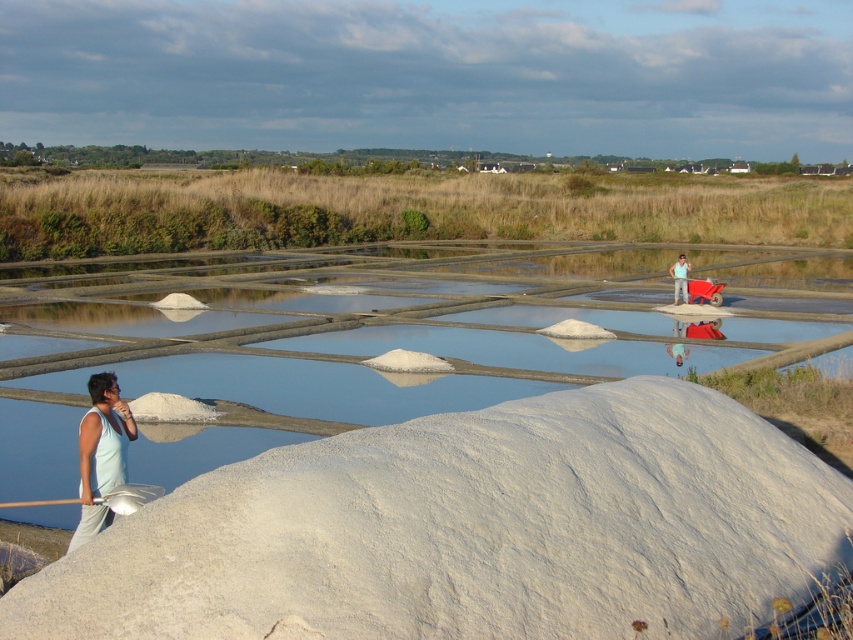
Question: From the image, what is the correct spatial relationship of green grassland at upper center in relation to light blue fabric shirt at center?

Choices:
 (A) right
 (B) left

Answer: (B)

Question: Which of the following is the closest to the observer?

Choices:
 (A) light blue tank top at left
 (B) white powdery cement at lower center

Answer: (B)

Question: Which is farther from the light blue tank top at left?

Choices:
 (A) white powdery cement at lower center
 (B) clear water at center
 (C) green grassland at upper center
 (D) light blue fabric shirt at center

Answer: (C)

Question: Does white powdery cement at lower center have a lesser width compared to green grassland at upper center?

Choices:
 (A) yes
 (B) no

Answer: (A)

Question: Does clear water at center have a larger size compared to green grassland at upper center?

Choices:
 (A) no
 (B) yes

Answer: (A)

Question: Which object is the farthest from the green grassland at upper center?

Choices:
 (A) clear water at center
 (B) light blue fabric shirt at center

Answer: (B)